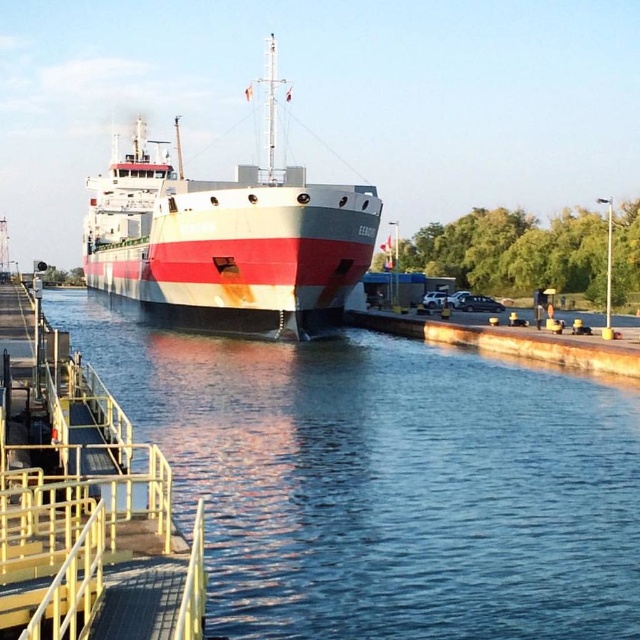
You are a sailor on the cargo ship and you need to navigate through the lock. There is a point marked at coordinates (384, 481). What is the condition of the water at that point?

The point at coordinates (384, 481) marks smooth water at lower center, so the water at that point is smooth.

You are a photographer standing at the platform and want to take a photo of the cargo ship. You notice two points marked on your map at coordinates point [291,541] and point [141,202]. Which point is closer to your current position on the platform?

Point [291,541] is closer to the camera than point [141,202], so the photographer should focus on that point to capture the ship more prominently in the frame.